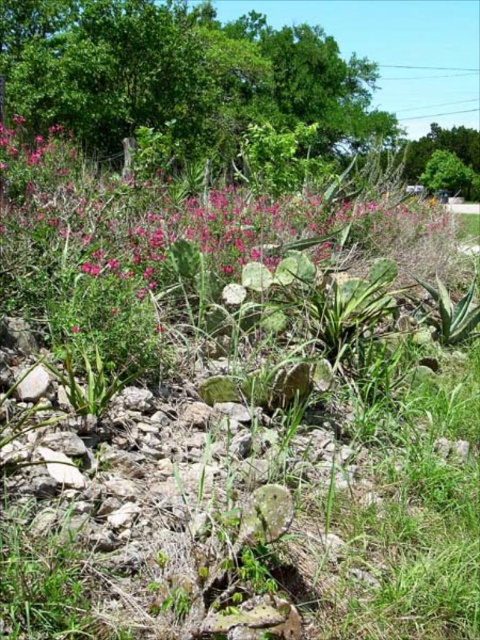
Question: Estimate the real-world distances between objects in this image. Which object is farther from the green leafy tree at upper right?

Choices:
 (A) green leafy tree at upper center
 (B) pink matte flowers at center

Answer: (B)

Question: Which of the following is the farthest from the observer?

Choices:
 (A) (192, 54)
 (B) (408, 172)
 (C) (380, 250)

Answer: (B)

Question: Which object is farther from the camera taking this photo?

Choices:
 (A) green leafy tree at upper right
 (B) green leafy tree at upper center

Answer: (A)

Question: Observing the image, what is the correct spatial positioning of pink matte flowers at center in reference to green leafy tree at upper right?

Choices:
 (A) left
 (B) right

Answer: (A)

Question: Does green leafy tree at upper center lie behind green leafy tree at upper right?

Choices:
 (A) yes
 (B) no

Answer: (B)

Question: Is green leafy tree at upper center bigger than green leafy tree at upper right?

Choices:
 (A) yes
 (B) no

Answer: (A)